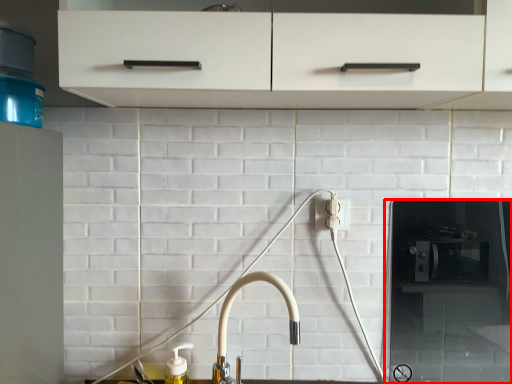
Question: From the image's perspective, what is the correct spatial positioning of appliance (annotated by the red box) in reference to tap?

Choices:
 (A) above
 (B) below

Answer: (A)